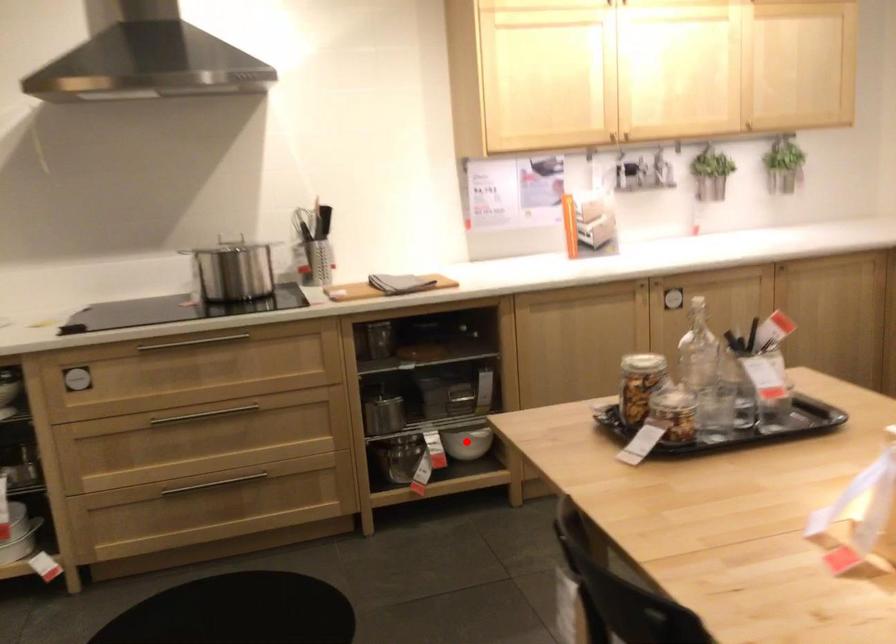
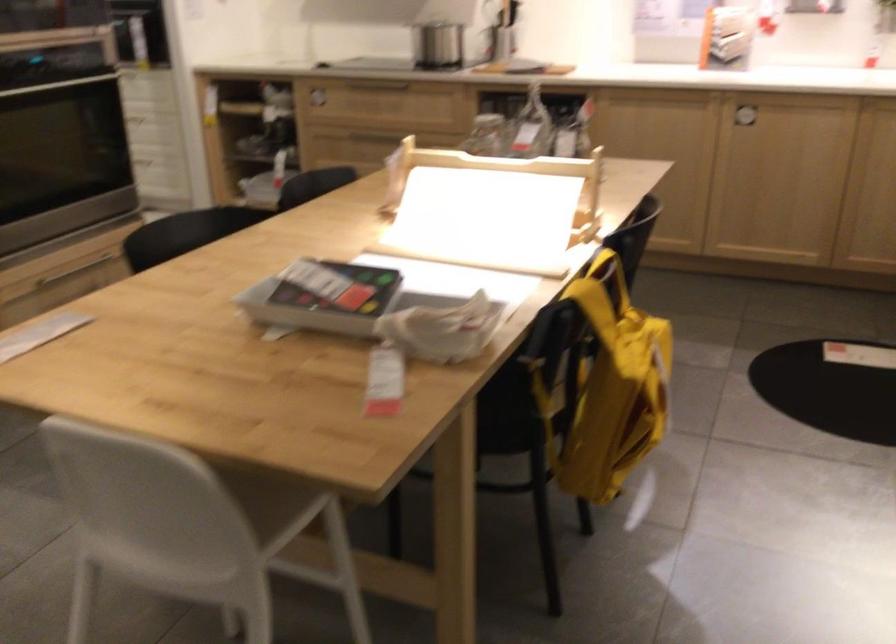
Question: I am providing you with two images of the same scene from different viewpoints. A red point is marked on the first image. Is the red point's position out of view in image 2?

Choices:
 (A) Yes
 (B) No

Answer: (A)